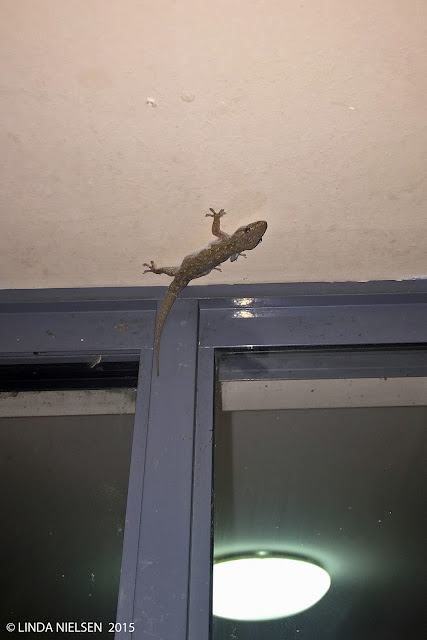
At what (x,y) coordinates should I click in order to perform the action: click on reflection of ceiling light. Please return your answer as a coordinate pair (x, y). Looking at the image, I should click on (249, 576).